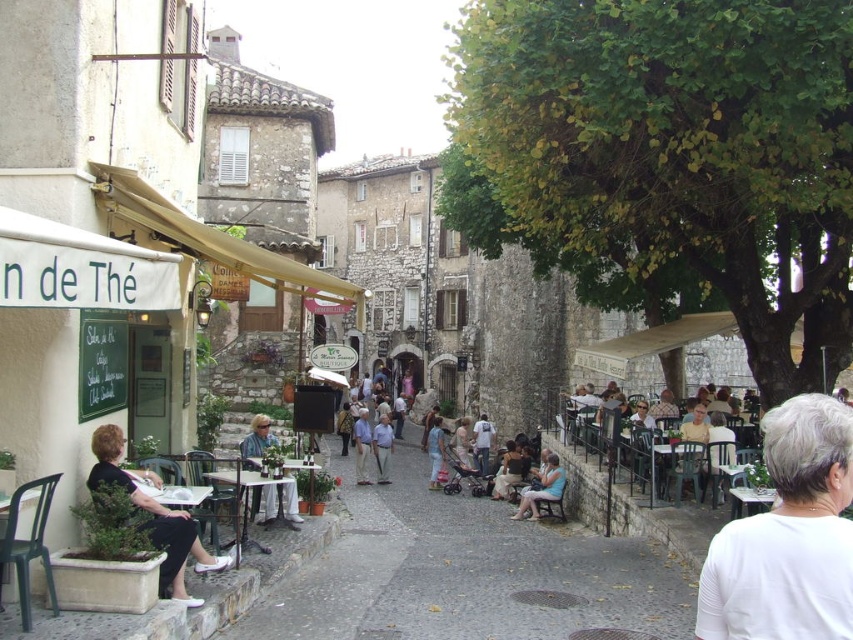
Can you confirm if light blue shirt at center is shorter than light blue denim jeans at center?

Correct, light blue shirt at center is not as tall as light blue denim jeans at center.

Does light blue shirt at center have a greater width compared to light blue denim jeans at center?

Yes, light blue shirt at center is wider than light blue denim jeans at center.

Is point (358, 452) closer to viewer compared to point (375, 428)?

Yes, it is.

You are a GUI agent. You are given a task and a screenshot of the screen. Output one action in this format:
    pyautogui.click(x=<x>, y=<y>)
    Task: Click on the light blue shirt at center
    This screenshot has width=853, height=640.
    Given the screenshot: What is the action you would take?
    pyautogui.click(x=361, y=445)

Does plastic green table at center appear on the left side of light blue shirt at center?

No, plastic green table at center is not to the left of light blue shirt at center.

Who is more forward, (x=654, y=449) or (x=363, y=410)?

Point (x=654, y=449) is more forward.

Where is `plastic green table at center`? This screenshot has width=853, height=640. plastic green table at center is located at coordinates coord(677,468).

Between white matte shirt at center and matte black table at center, which one is positioned lower?

white matte shirt at center is lower down.

Does point (819, 436) lie in front of point (259, 449)?

Yes.

The width and height of the screenshot is (853, 640). Find the location of `white matte shirt at center`. white matte shirt at center is located at coordinates point(788,536).